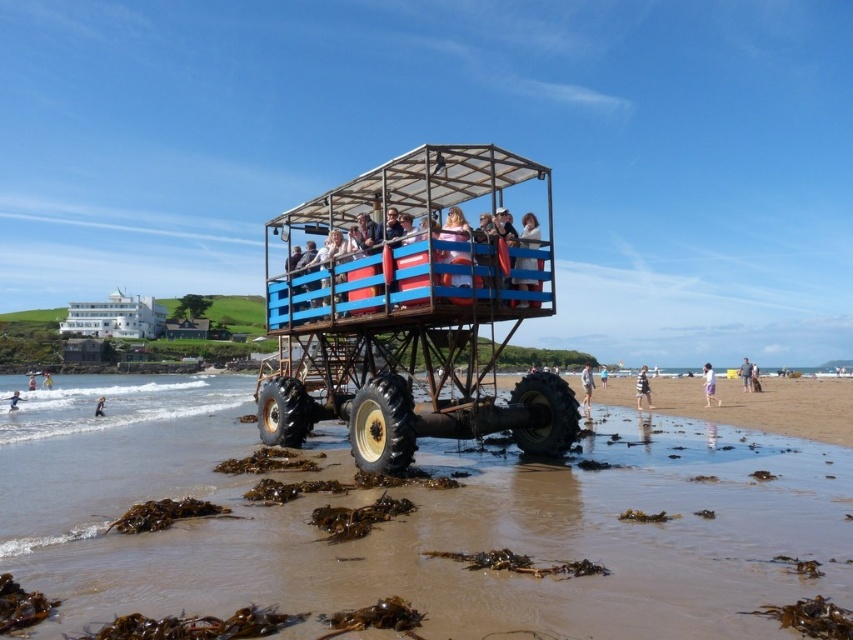
Question: Is clear water at lower left above blue fabric shirt at center?

Choices:
 (A) yes
 (B) no

Answer: (A)

Question: In this image, where is white striped shirt at lower right located relative to white wetsuit at lower center?

Choices:
 (A) above
 (B) below

Answer: (B)

Question: Estimate the real-world distances between objects in this image. Which object is closer to the gray fabric shorts at lower right?

Choices:
 (A) clear water at lower left
 (B) light blue fabric person at lower left
 (C) white wetsuit at lower center

Answer: (C)

Question: Which is nearer to the brown sandy mud at center?

Choices:
 (A) light blue fabric person at lower left
 (B) light blue fabric shirt at center

Answer: (A)

Question: Is clear water at lower left thinner than white wetsuit at lower center?

Choices:
 (A) no
 (B) yes

Answer: (A)

Question: Which object appears farthest from the camera in this image?

Choices:
 (A) light blue fabric person at lower left
 (B) brown sandy mud at center
 (C) light brown wooden surfboard at center

Answer: (C)